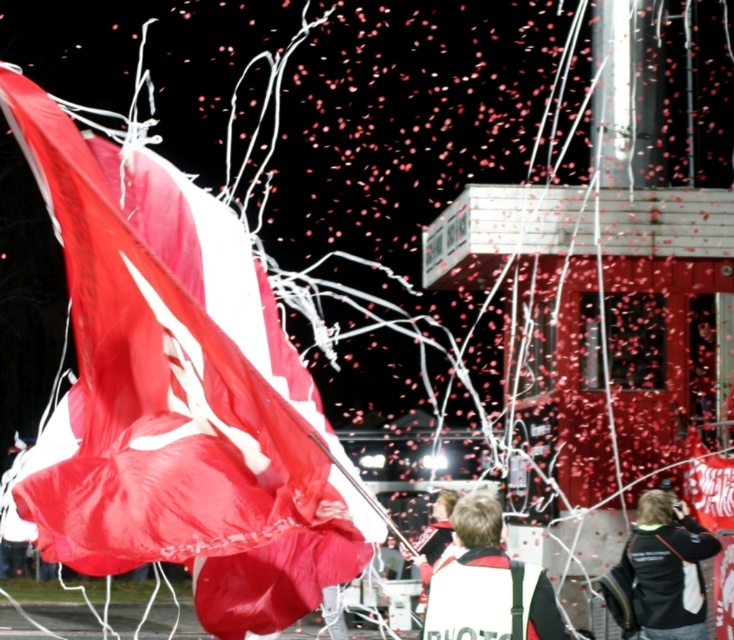
You are a photographer trying to capture both the matte red flag at left and the white fabric vest at center in a single frame. Given their sizes, which object should you focus on first to ensure both are in the frame without cropping?

The matte red flag at left is larger than the white fabric vest at center, so you should focus on positioning the matte red flag at left first to accommodate its size, then adjust the frame to include the smaller white fabric vest at center.

You are a costume designer preparing for a performance. You have two garments available for the lead actor to wear during a scene where they need to move freely. The garments are the white fabric vest at center and the black fabric jacket at lower right. Based on their sizes, which garment would allow for more comfortable movement?

The white fabric vest at center has a larger width than the black fabric jacket at lower right, so it would allow for more comfortable movement during the performance.

You are standing at the center of the image and see two points, point (90, 323) and point (708, 548). Which point is closer to you?

Point (90, 323) is in front of point (708, 548), so it is closer to you.